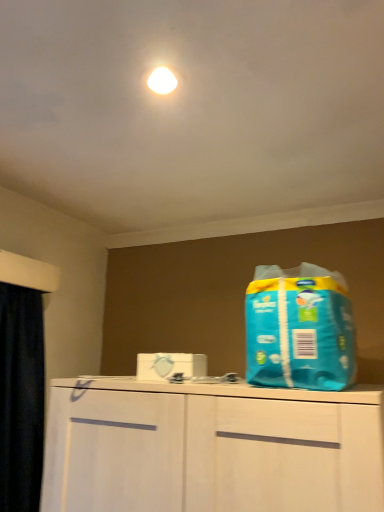
Question: From a real-world perspective, is black fabric curtain at left located higher than blue plastic bag at right?

Choices:
 (A) yes
 (B) no

Answer: (B)

Question: From the image's perspective, would you say black fabric curtain at left is shown under blue plastic bag at right?

Choices:
 (A) yes
 (B) no

Answer: (A)

Question: Considering the relative sizes of black fabric curtain at left and blue plastic bag at right in the image provided, is black fabric curtain at left smaller than blue plastic bag at right?

Choices:
 (A) no
 (B) yes

Answer: (A)

Question: Considering the relative positions of black fabric curtain at left and blue plastic bag at right in the image provided, is black fabric curtain at left in front of blue plastic bag at right?

Choices:
 (A) yes
 (B) no

Answer: (B)

Question: Are black fabric curtain at left and blue plastic bag at right making contact?

Choices:
 (A) no
 (B) yes

Answer: (A)

Question: From the image's perspective, is black fabric curtain at left above blue plastic bag at right?

Choices:
 (A) yes
 (B) no

Answer: (B)

Question: From a real-world perspective, is blue plastic bag at right beneath black fabric curtain at left?

Choices:
 (A) no
 (B) yes

Answer: (A)

Question: Does blue plastic bag at right have a lesser width compared to black fabric curtain at left?

Choices:
 (A) yes
 (B) no

Answer: (B)

Question: Is blue plastic bag at right at the right side of black fabric curtain at left?

Choices:
 (A) no
 (B) yes

Answer: (B)

Question: Is blue plastic bag at right turned away from black fabric curtain at left?

Choices:
 (A) yes
 (B) no

Answer: (B)

Question: Considering the relative positions of blue plastic bag at right and black fabric curtain at left in the image provided, is blue plastic bag at right to the left of black fabric curtain at left from the viewer's perspective?

Choices:
 (A) yes
 (B) no

Answer: (B)

Question: Is blue plastic bag at right aimed at black fabric curtain at left?

Choices:
 (A) no
 (B) yes

Answer: (A)

Question: In the image, is black fabric curtain at left positioned in front of or behind blue plastic bag at right?

Choices:
 (A) behind
 (B) front

Answer: (A)